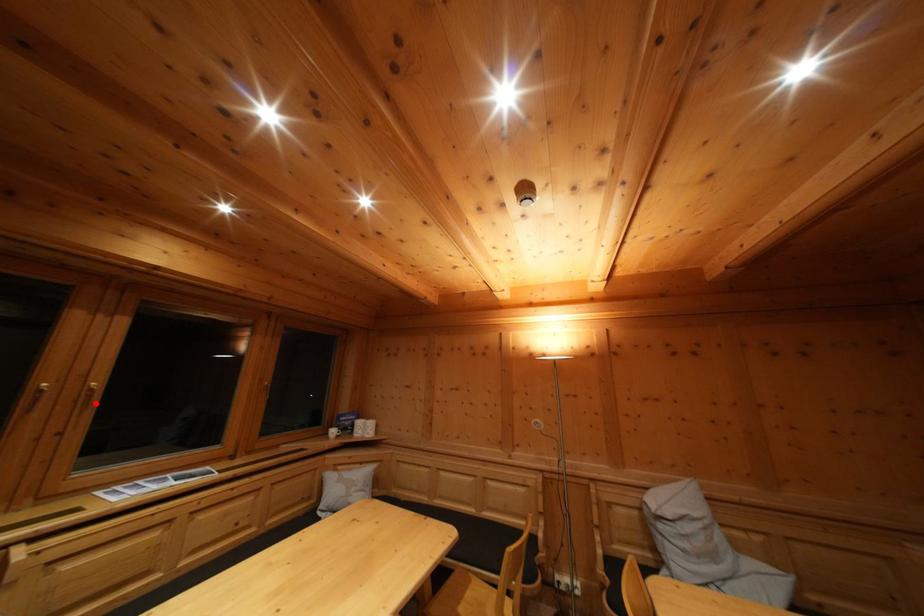
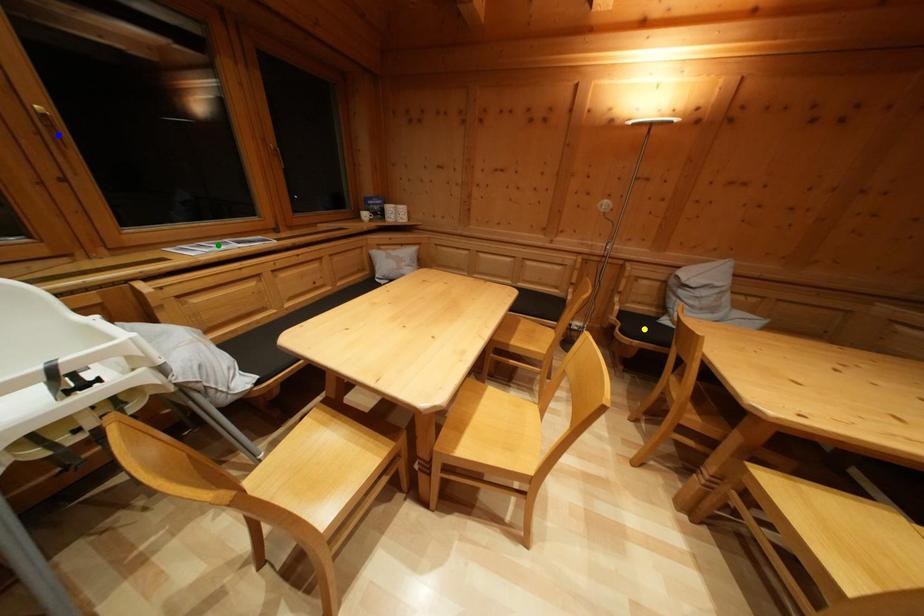
Question: I am providing you with two images of the same scene from different viewpoints. A red point is marked on the first image. You are given multiple points on the second image. In image 2, which mark is for the same physical point as the one in image 1?

Choices:
 (A) green point
 (B) yellow point
 (C) blue point

Answer: (C)